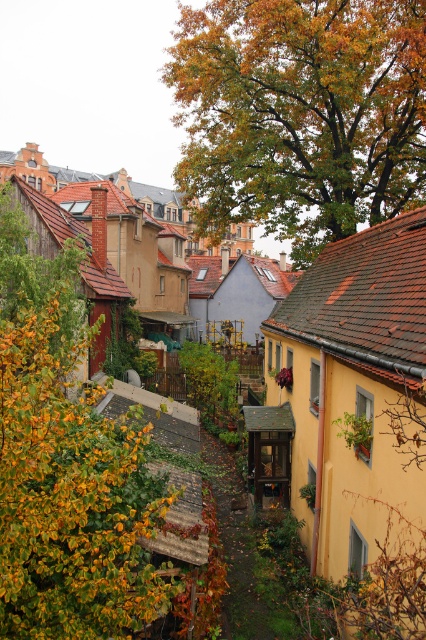
What are the coordinates of the green leafy tree at upper center?

The green leafy tree at upper center is located at coordinates point (301, 115).

You are standing at the entrance of the alleyway and notice two green leafy trees in the scene. Which tree, the green leafy tree at upper center or the green leafy tree at left, has a larger width?

The green leafy tree at upper center might be wider than the green leafy tree at left according to the description.